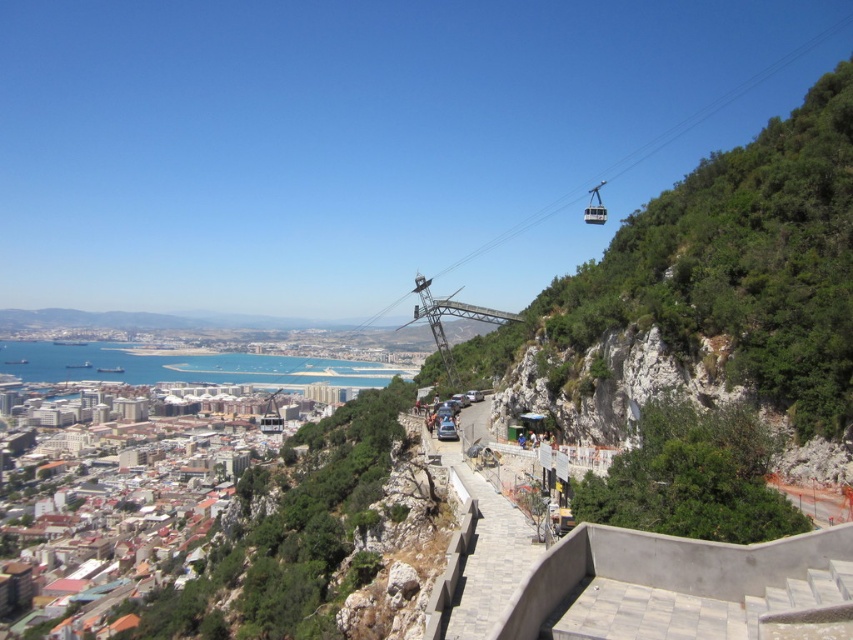
Question: Among these points, which one is farthest from the camera?

Choices:
 (A) (438, 435)
 (B) (590, 200)

Answer: (B)

Question: Does metallic cable car at upper center appear on the right side of metallic cable car at center?

Choices:
 (A) yes
 (B) no

Answer: (A)

Question: Can you confirm if metallic cable car at upper center is positioned above metallic cable car at center?

Choices:
 (A) yes
 (B) no

Answer: (A)

Question: Which object is farther from the camera taking this photo?

Choices:
 (A) metallic cable car at center
 (B) metallic cable car at upper center

Answer: (B)

Question: Can you confirm if metallic cable car at upper center is positioned to the left of metallic cable car at center?

Choices:
 (A) yes
 (B) no

Answer: (B)